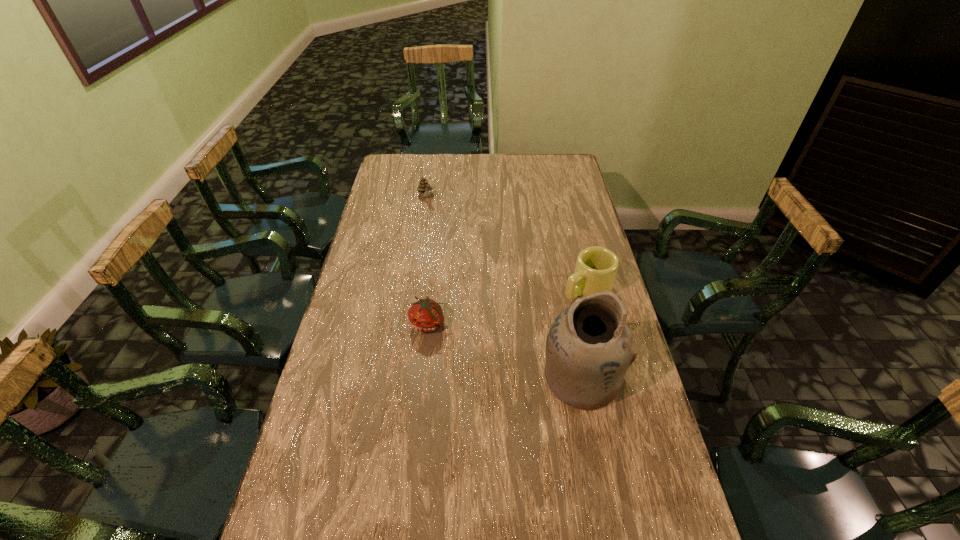
Where is `vacant area between the third nearest object and the second nearest object`? vacant area between the third nearest object and the second nearest object is located at coordinates (508, 307).

Locate an element on the screen. This screenshot has height=540, width=960. vacant area that lies between the second nearest object and the snail is located at coordinates (427, 260).

The image size is (960, 540). What are the coordinates of `free point between the nearest object and the shortest object` in the screenshot? It's located at (505, 350).

Locate an element on the screen. The width and height of the screenshot is (960, 540). free area in between the tallest object and the second nearest object is located at coordinates (505, 350).

Locate an element on the screen. Image resolution: width=960 pixels, height=540 pixels. free spot between the second farthest object and the snail is located at coordinates (506, 243).

Where is `vacant region between the mug and the tomato`? The image size is (960, 540). vacant region between the mug and the tomato is located at coordinates (508, 307).

Identify which object is the third nearest to the mug. Please provide its 2D coordinates. Your answer should be formatted as a tuple, i.e. [(x, y)], where the tuple contains the x and y coordinates of a point satisfying the conditions above.

[(424, 187)]

Locate an element on the screen. This screenshot has width=960, height=540. the closest object to the second farthest object is located at coordinates (589, 348).

Image resolution: width=960 pixels, height=540 pixels. What are the coordinates of `vacant point that satisfies the following two spatial constraints: 1. on the front-facing side of the second nearest object; 2. on the right side of the nearest object` in the screenshot? It's located at (422, 377).

In order to click on free space that satisfies the following two spatial constraints: 1. on the front-facing side of the tallest object; 2. on the left side of the shortest object in this screenshot , I will do `click(422, 377)`.